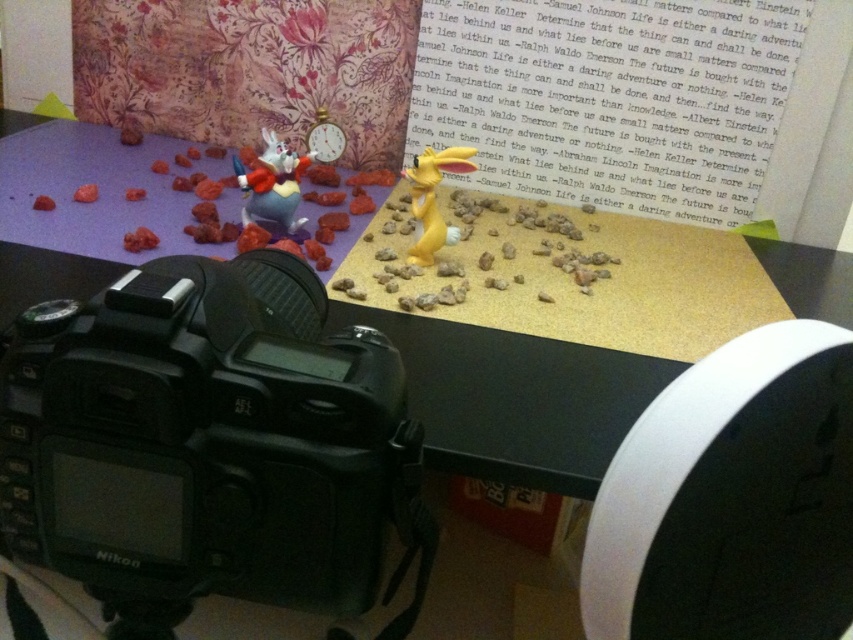
You are setting up a photography project and need to know if the black plastic camera at lower left can be placed next to the matte plastic rabbit at upper left without overlapping. Based on their sizes, will they fit side by side?

The black plastic camera at lower left is larger in width than the matte plastic rabbit at upper left. Since the camera is wider, they can still fit side by side as long as there is enough space between them, but the camera will take up more horizontal space.

You are a photographer setting up a miniature scene. You have a matte plastic rabbit at upper left and a yellow matte rabbit at center. Which rabbit is closer to the camera?

The matte plastic rabbit at upper left is closer to the camera than the yellow matte rabbit at center because it is further to the viewer.

You are a photographer setting up a miniature scene with a Nikon DSLR camera on a tripod. You want to ensure that the point at coordinates point (x=16, y=349) is in focus. Given that the camera has a depth of field of 15 inches, will this point be within the depth of field if the camera is focused at 20 inches?

The distance of point (x=16, y=349) from the camera is 18.67 inches. Since the depth of field is 15 inches, the range in focus would be from 20 inches minus 7.5 inches to 20 inches plus 7.5 inches, which is 12.5 to 27.5 inches. Since 18.67 inches falls within this range, the point will be within the depth of field.